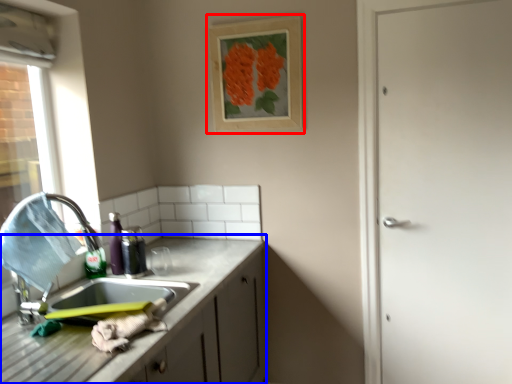
Question: Among these objects, which one is farthest to the camera, picture frame (highlighted by a red box) or cabinetry (highlighted by a blue box)?

Choices:
 (A) picture frame
 (B) cabinetry

Answer: (A)